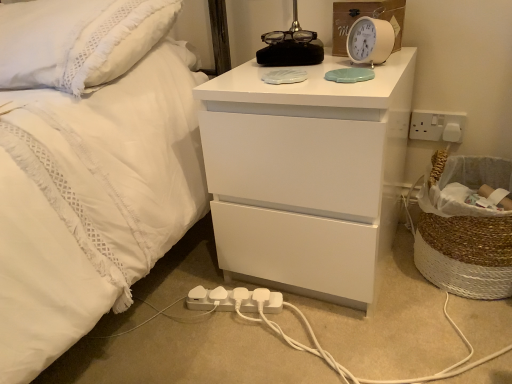
At what (x,y) coordinates should I click in order to perform the action: click on free space in front of braided straw laundry basket at right. Please return your answer as a coordinate pair (x, y). Looking at the image, I should click on (457, 339).